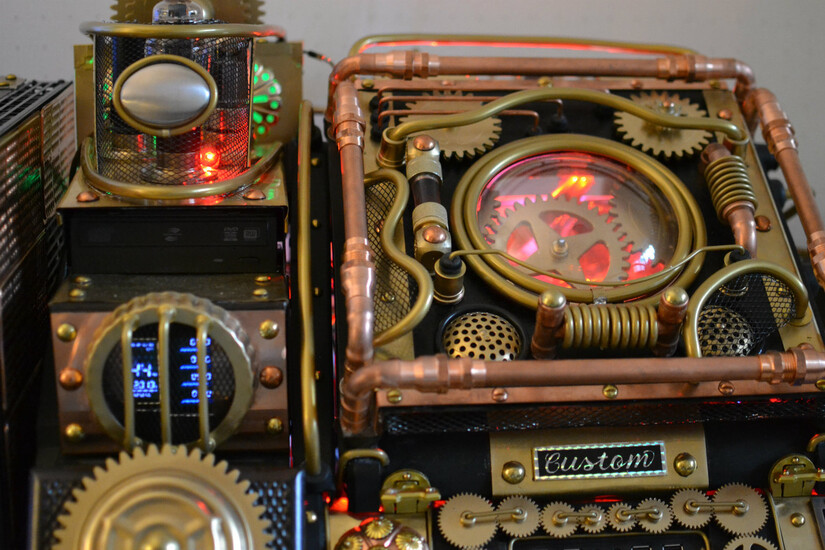
Locate an element on the screen. The image size is (825, 550). wall is located at coordinates (776, 25).